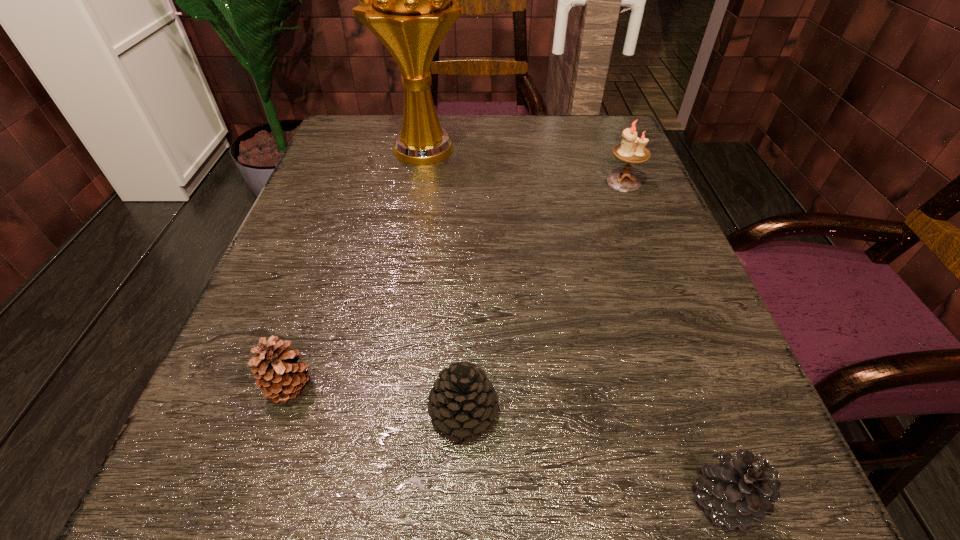
The width and height of the screenshot is (960, 540). I want to click on trophy_cup, so click(409, 0).

Locate an element on the screen. The image size is (960, 540). the fourth shortest object is located at coordinates (632, 149).

The height and width of the screenshot is (540, 960). What are the coordinates of `the leftmost pinecone` in the screenshot? It's located at (278, 374).

The width and height of the screenshot is (960, 540). Find the location of `the second pinecone from left to right`. the second pinecone from left to right is located at coordinates (462, 403).

In order to click on the rightmost pinecone in this screenshot , I will do `click(740, 491)`.

I want to click on the nearest object, so click(x=740, y=491).

Find the location of a particular element. The height and width of the screenshot is (540, 960). free space located 0.300m at the front of the tallest object where the globe is prominent is located at coordinates (606, 149).

At what (x,y) coordinates should I click in order to perform the action: click on free point located 0.240m on the back of the fourth shortest object. Please return your answer as a coordinate pair (x, y). This screenshot has width=960, height=540. Looking at the image, I should click on (598, 119).

Locate an element on the screen. blank space located on the right of the leftmost pinecone is located at coordinates pyautogui.click(x=429, y=387).

This screenshot has height=540, width=960. What are the coordinates of `free point located at the narrow end of the second pinecone from left to right` in the screenshot? It's located at (579, 413).